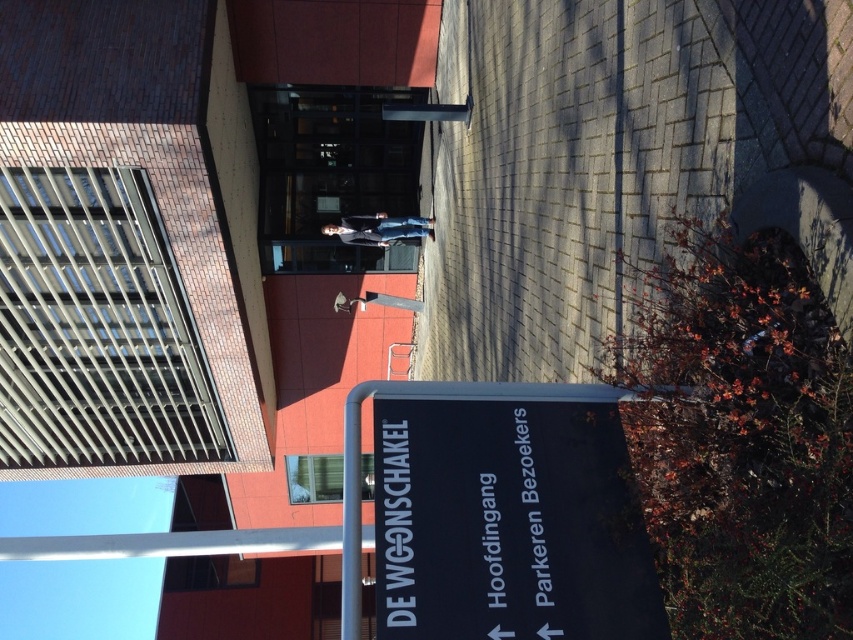
Question: Which of the following is the closest to the observer?

Choices:
 (A) light blue jeans at center
 (B) metallic gray pole at center
 (C) black plastic sign at center

Answer: (C)

Question: Is black plastic sign at center smaller than metallic gray pole at center?

Choices:
 (A) no
 (B) yes

Answer: (B)

Question: Is black plastic sign at center smaller than metallic gray pole at center?

Choices:
 (A) yes
 (B) no

Answer: (A)

Question: Which point is farther to the camera?

Choices:
 (A) (349, 230)
 (B) (392, 429)

Answer: (A)

Question: Among these objects, which one is farthest from the camera?

Choices:
 (A) metallic gray pole at center
 (B) black plastic sign at center
 (C) light blue jeans at center

Answer: (C)

Question: Does black plastic sign at center appear on the left side of metallic gray pole at center?

Choices:
 (A) no
 (B) yes

Answer: (A)